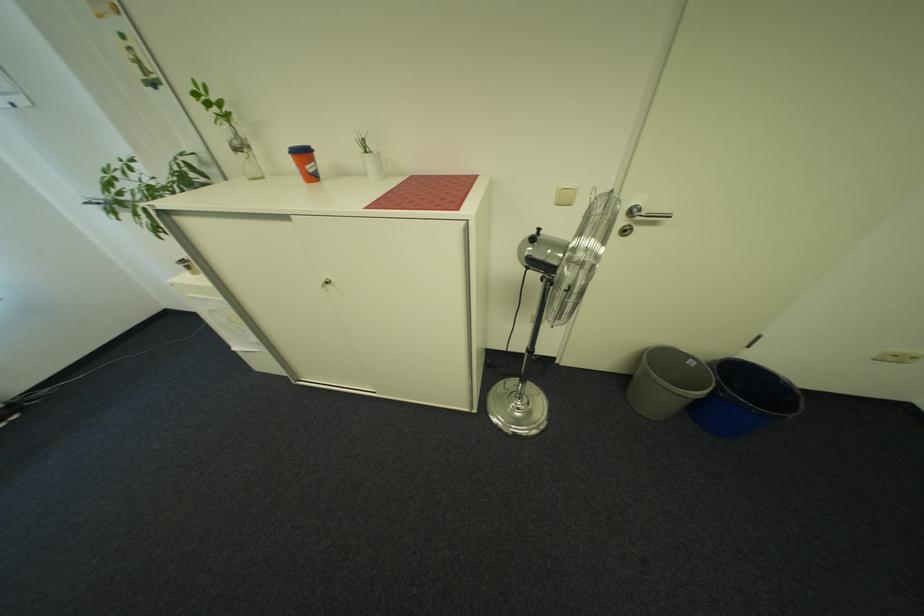
Where would you pull the fan control knob? Please return your answer as a coordinate pair (x, y).

(531, 241)